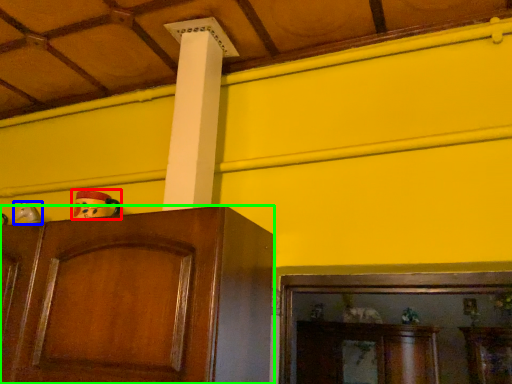
Question: Which is farther away from toy (highlighted by a red box)? toy (highlighted by a blue box) or cabinetry (highlighted by a green box)?

Choices:
 (A) toy
 (B) cabinetry

Answer: (A)